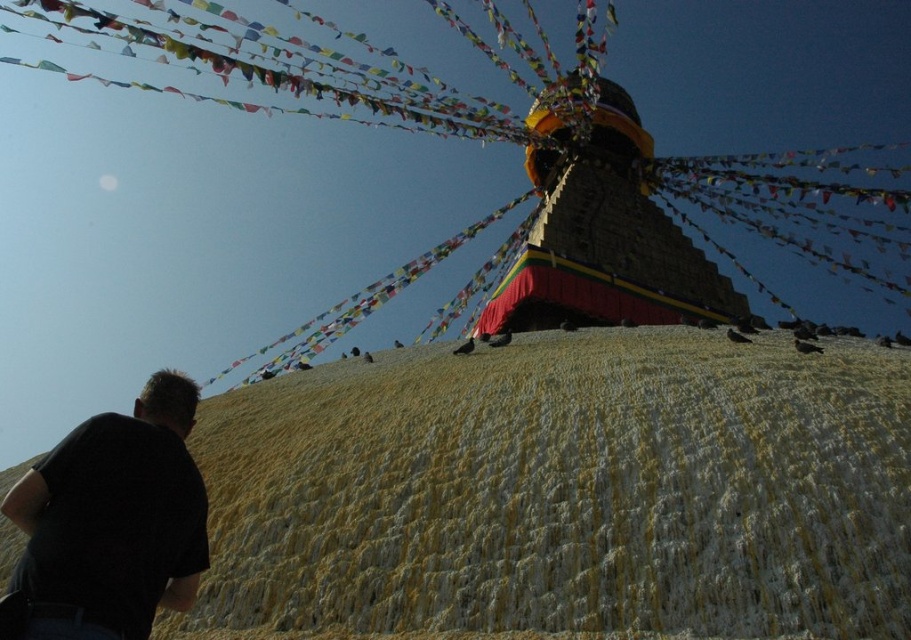
You are a photographer positioned at a certain distance from the yellow textured mound at center. You want to capture a clear photo of the stupa on top of it without any obstructions. Given that your camera has a maximum focus range of 35 meters, will you be able to take the photo successfully?

The yellow textured mound at center is 36.94 meters away from the viewer. Since the camera can only focus up to 35 meters, the distance is beyond the camera s maximum focus range. Therefore, you won t be able to take a clear photo of the stupa on top of the yellow textured mound at center.